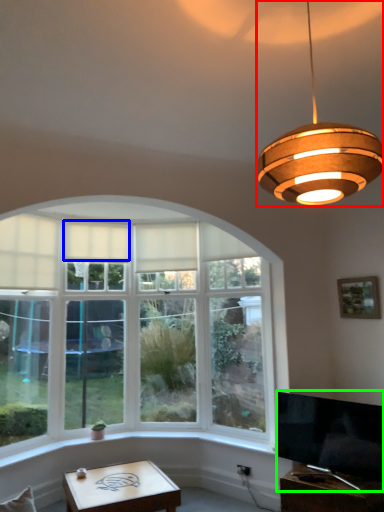
Question: Considering the real-world distances, which object is closest to lamp (highlighted by a red box)? curtain (highlighted by a blue box) or television (highlighted by a green box).

Choices:
 (A) curtain
 (B) television

Answer: (B)